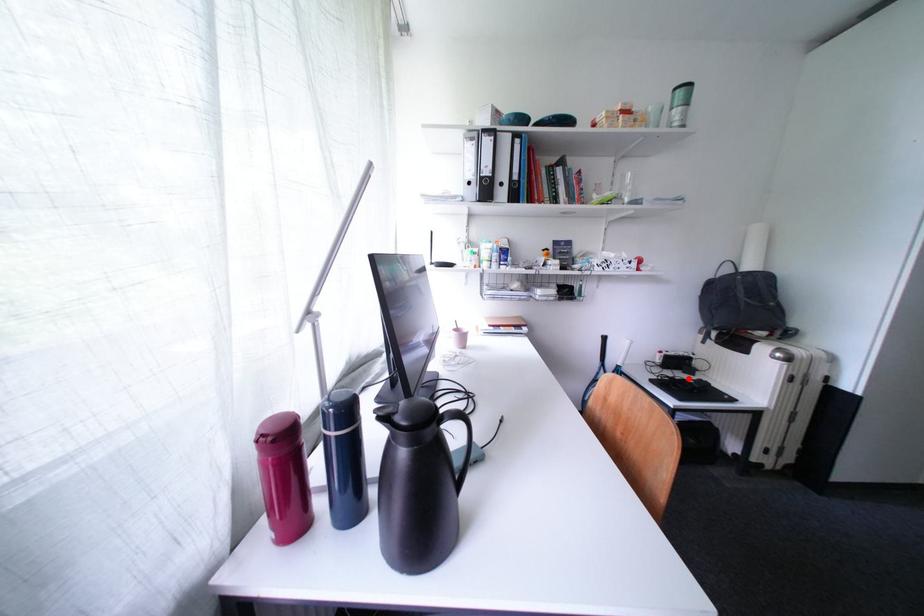
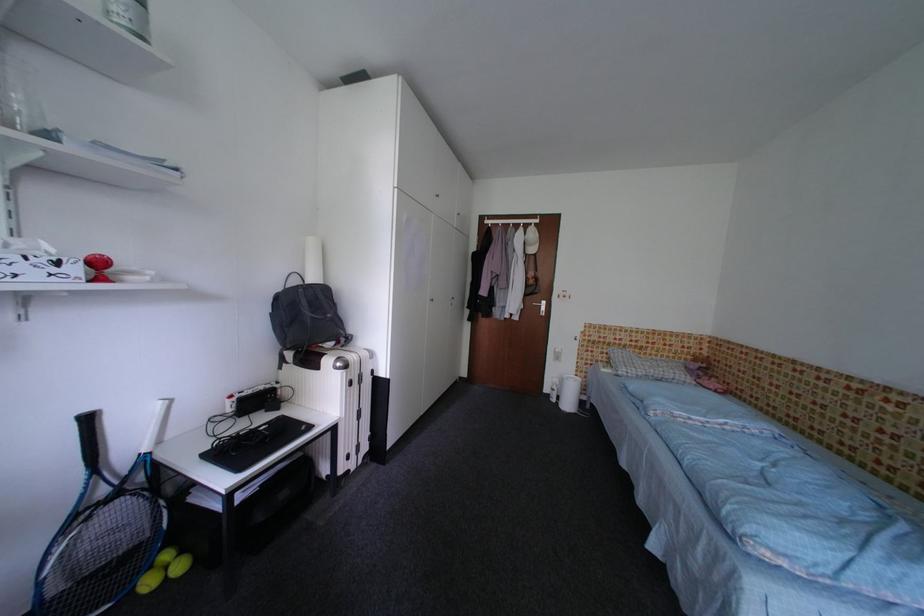
The point at the highlighted location is marked in the first image. Where is the corresponding point in the second image?

(270, 421)